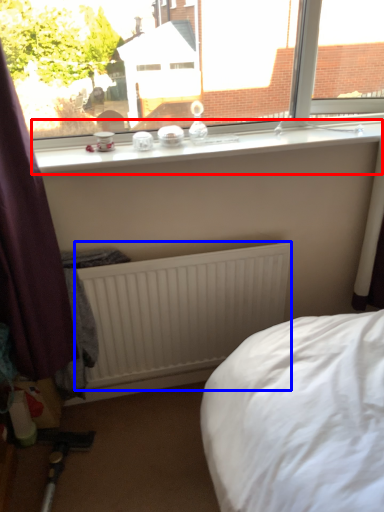
Question: Which of the following is the farthest to the observer, window sill (highlighted by a red box) or radiator (highlighted by a blue box)?

Choices:
 (A) window sill
 (B) radiator

Answer: (B)